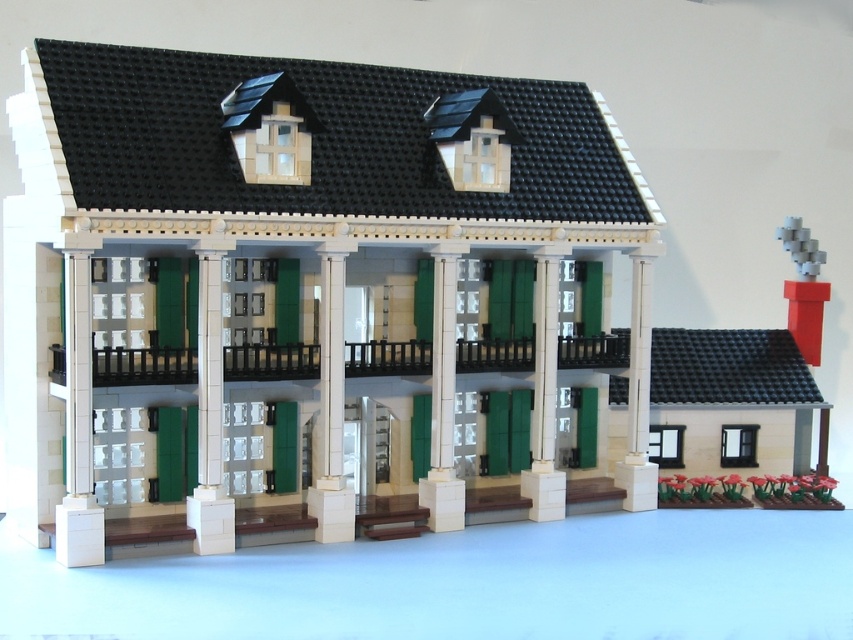
You are an architect inspecting the LEGO house model. You notice two columns at the center of the front porch. One is labeled as the white smooth column at center and the other as the white glossy column at center. Which column would require more LEGO bricks to construct based on their size?

The white smooth column at center has a larger size compared to the white glossy column at center, so it would require more LEGO bricks to construct.

You are standing on the front porch of the LEGO house and notice two columns in front of you. Which column, the white smooth column at center or the white glossy column at center, is closer to you?

The white smooth column at center is closer to you because it is positioned in front of the white glossy column at center.